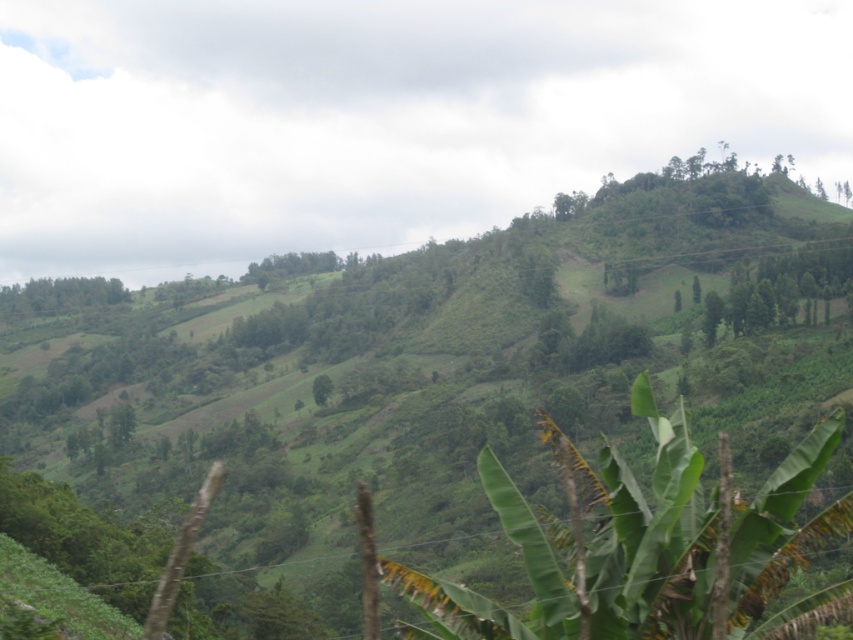
Question: From the image, what is the correct spatial relationship of green leafy banana tree at center in relation to green leafy trees at left?

Choices:
 (A) below
 (B) above

Answer: (A)

Question: Is green leafy banana tree at center positioned in front of green leafy trees at left?

Choices:
 (A) no
 (B) yes

Answer: (B)

Question: Among these objects, which one is farthest from the camera?

Choices:
 (A) green leafy trees at left
 (B) green leafy banana tree at center

Answer: (A)

Question: Does green leafy banana tree at center appear on the right side of green leafy trees at left?

Choices:
 (A) no
 (B) yes

Answer: (B)